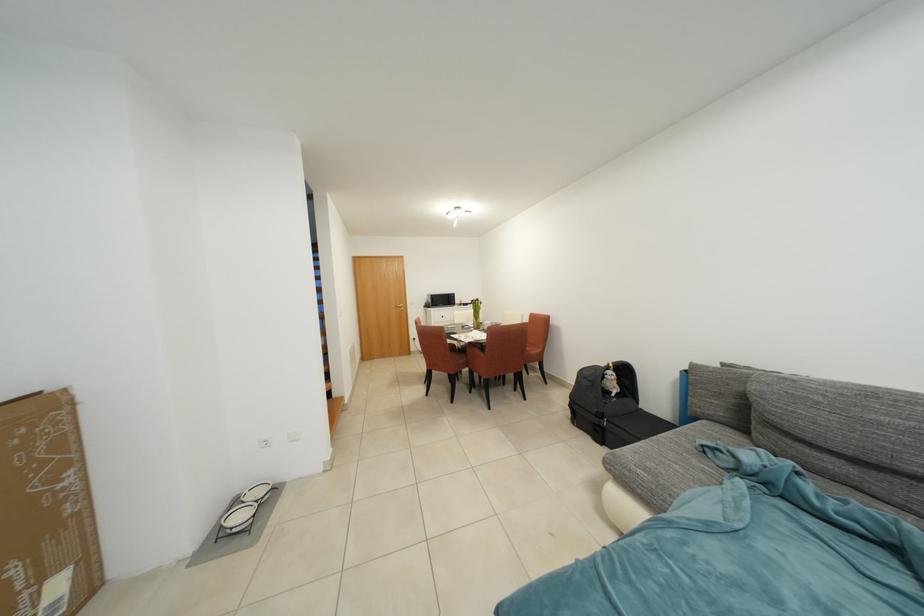
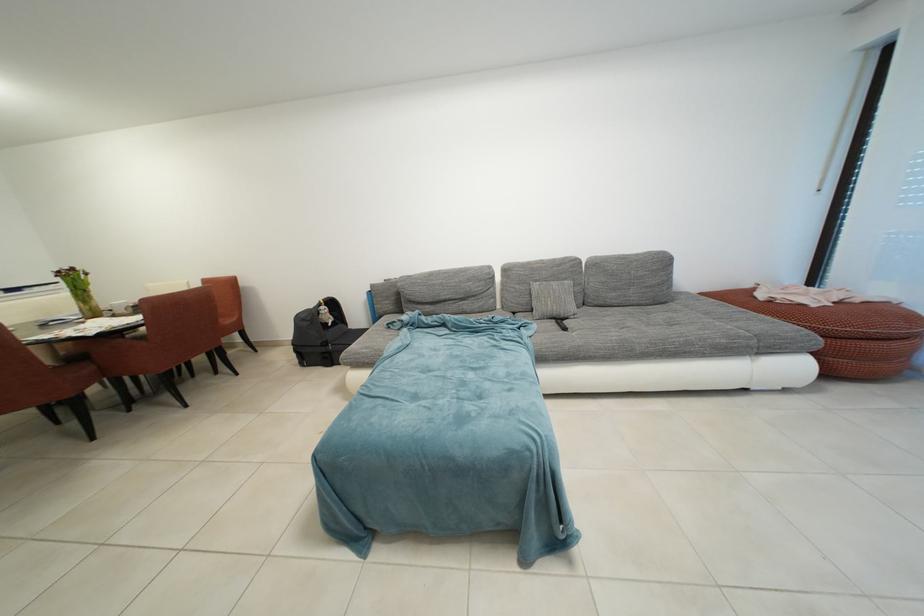
The point at (485, 304) is marked in the first image. Where is the corresponding point in the second image?

(81, 274)